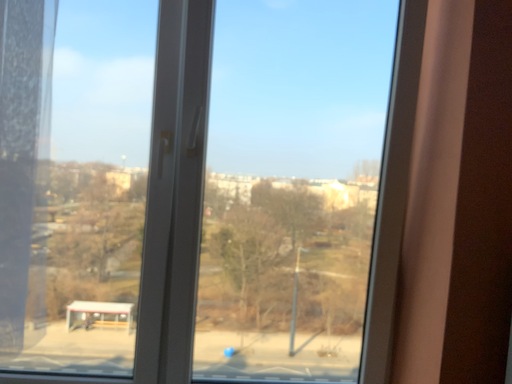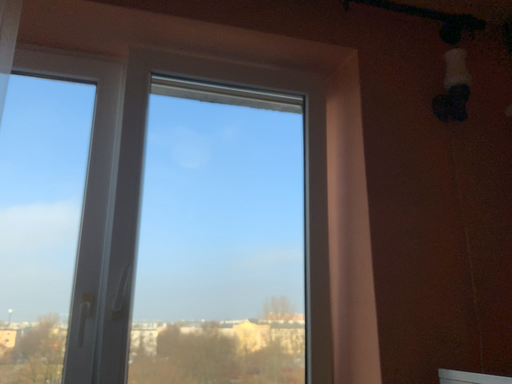
Question: Which way did the camera rotate in the video?

Choices:
 (A) rotated downward
 (B) rotated upward

Answer: (B)